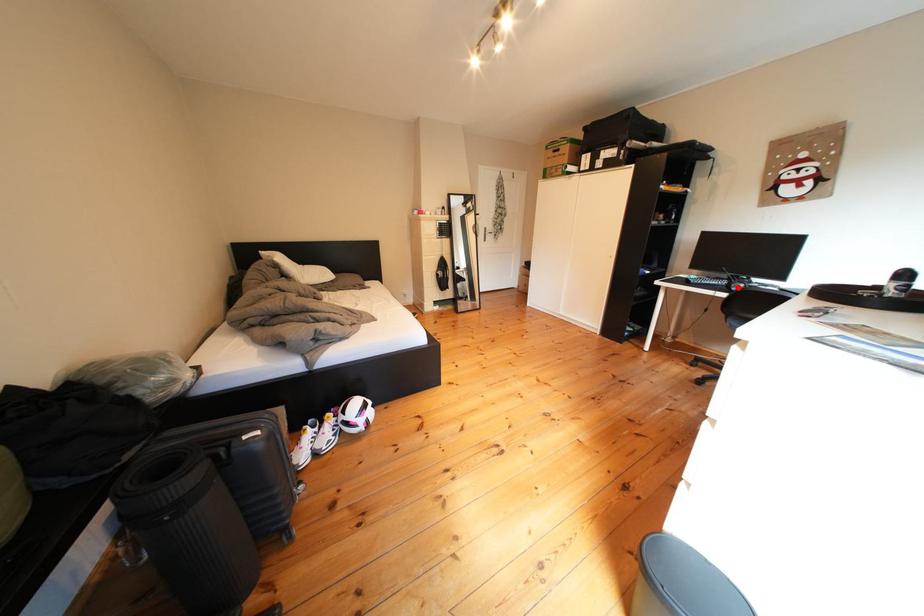
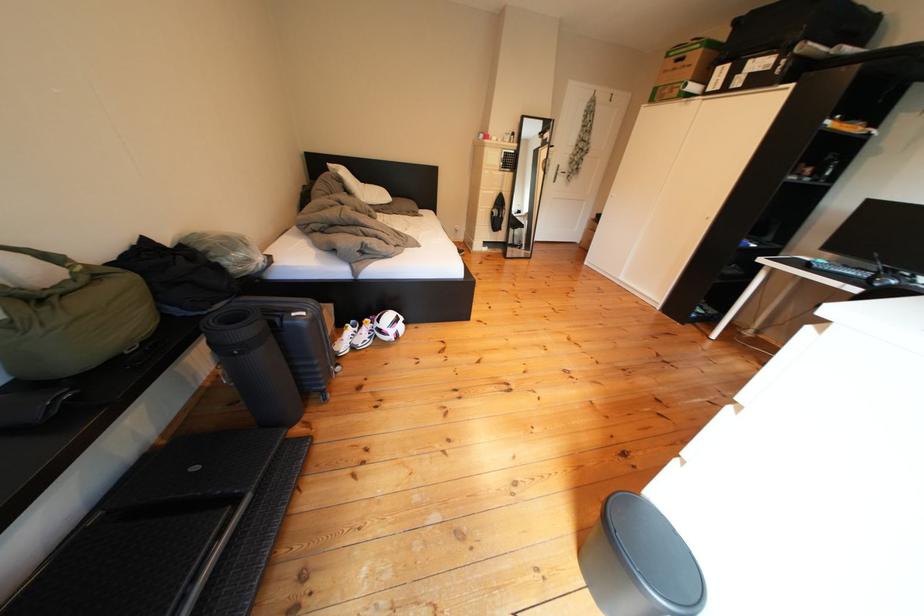
Question: A red point is marked in image1. In image2, is the corresponding 3D point closer to the camera or farther? Reply with the corresponding letter.

Choices:
 (A) The corresponding 3D point is closer.
 (B) The corresponding 3D point is farther.

Answer: (B)